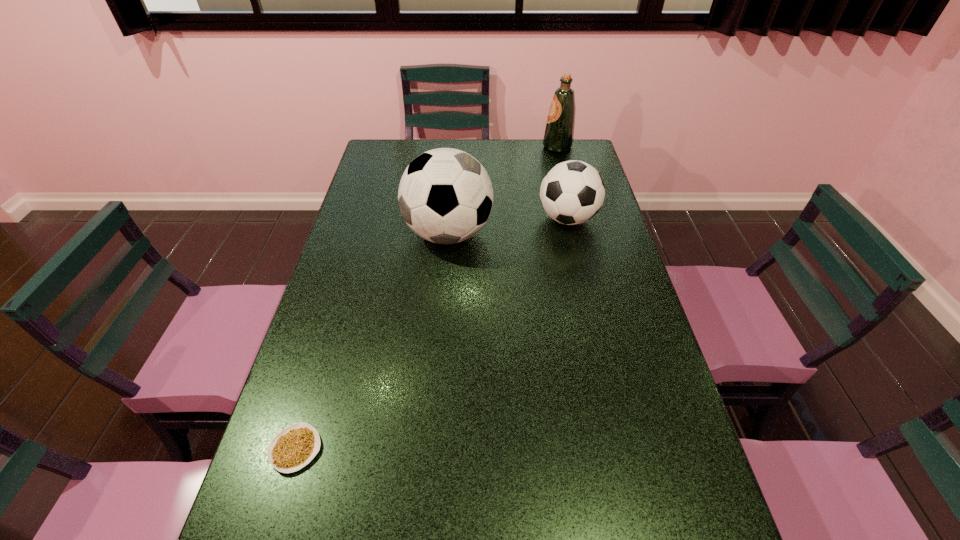
Locate which object ranks in proximity to the second shortest object. Please provide its 2D coordinates. Your answer should be formatted as a tuple, i.e. [(x, y)], where the tuple contains the x and y coordinates of a point satisfying the conditions above.

[(445, 195)]

You are a GUI agent. You are given a task and a screenshot of the screen. Output one action in this format:
    pyautogui.click(x=<x>, y=<y>)
    Task: Click on the free location that satisfies the following two spatial constraints: 1. on the front side of the right soccer ball; 2. on the main logo of the left soccer ball
    The image size is (960, 540).
    Given the screenshot: What is the action you would take?
    pyautogui.click(x=571, y=233)

Where is `blank area in the image that satisfies the following two spatial constraints: 1. on the front-facing side of the olive oil; 2. on the front side of the right soccer ball`? blank area in the image that satisfies the following two spatial constraints: 1. on the front-facing side of the olive oil; 2. on the front side of the right soccer ball is located at coordinates (575, 219).

At what (x,y) coordinates should I click in order to perform the action: click on vacant space that satisfies the following two spatial constraints: 1. on the main logo of the taller soccer ball; 2. on the front side of the leftmost object. Please return your answer as a coordinate pair (x, y). Looking at the image, I should click on (431, 449).

This screenshot has width=960, height=540. Find the location of `vacant space that satisfies the following two spatial constraints: 1. on the main logo of the third object from right to left; 2. on the front side of the nearest object`. vacant space that satisfies the following two spatial constraints: 1. on the main logo of the third object from right to left; 2. on the front side of the nearest object is located at coordinates (431, 449).

What are the coordinates of `blank area in the image that satisfies the following two spatial constraints: 1. on the front-facing side of the farthest object; 2. on the front side of the leftmost object` in the screenshot? It's located at (633, 449).

Locate an element on the screen. The image size is (960, 540). free space that satisfies the following two spatial constraints: 1. on the main logo of the left soccer ball; 2. on the front side of the shortest object is located at coordinates (431, 449).